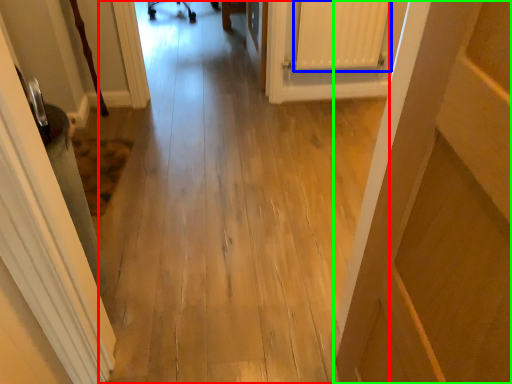
Question: Based on their relative distances, which object is farther from path (highlighted by a red box)? Choose from radiator (highlighted by a blue box) and door (highlighted by a green box).

Choices:
 (A) radiator
 (B) door

Answer: (B)